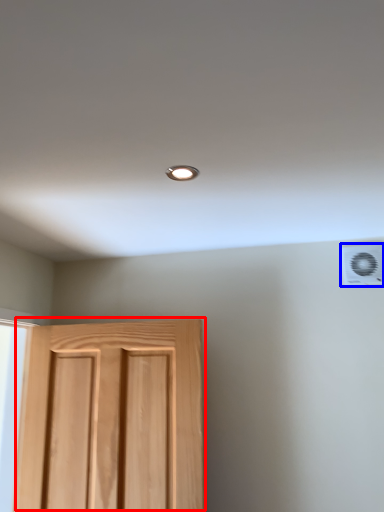
Question: Which of the following is the farthest to the observer, door (highlighted by a red box) or air conditioning (highlighted by a blue box)?

Choices:
 (A) door
 (B) air conditioning

Answer: (B)